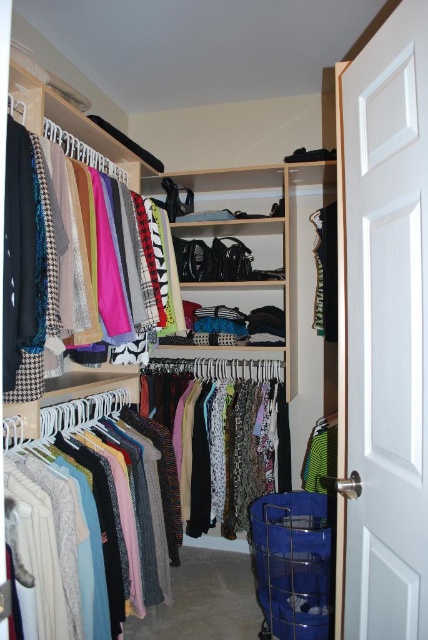
Question: Can you confirm if multicolored fabric at center is positioned above green jersey at center?

Choices:
 (A) yes
 (B) no

Answer: (B)

Question: Estimate the real-world distances between objects in this image. Which object is closer to the green jersey at center?

Choices:
 (A) multicolored fabric at center
 (B) knitwear at left

Answer: (A)

Question: Which is nearer to the matte black scarf at upper left?

Choices:
 (A) knitwear at left
 (B) green jersey at center
 (C) multicolored fabric at center
 (D) blue plastic laundry basket at lower right

Answer: (A)

Question: In this image, where is matte wooden closet at center located relative to green jersey at center?

Choices:
 (A) right
 (B) left

Answer: (B)

Question: Is knitwear at left positioned before green jersey at center?

Choices:
 (A) no
 (B) yes

Answer: (B)

Question: Based on their relative distances, which object is farther from the knitwear at left?

Choices:
 (A) matte black scarf at upper left
 (B) matte wooden closet at center

Answer: (B)